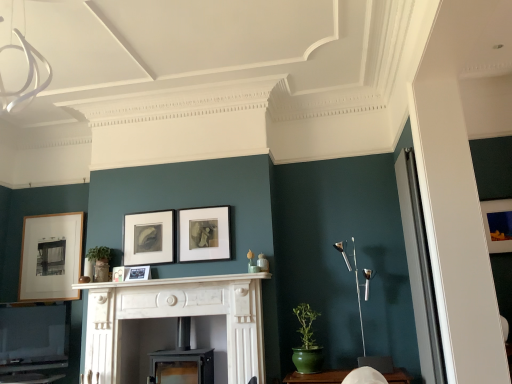
Question: From the image's perspective, is black matte picture frame at center, the fifth picture frame when ordered from left to right, beneath matte black picture frame at center, the third picture frame viewed from the left?

Choices:
 (A) yes
 (B) no

Answer: (B)

Question: From a real-world perspective, is black matte picture frame at center, the fifth picture frame when ordered from left to right, physically below matte black picture frame at center, the third picture frame viewed from the left?

Choices:
 (A) no
 (B) yes

Answer: (A)

Question: Is black matte picture frame at center, placed as the 2th picture frame when sorted from right to left, aimed at matte black picture frame at center, the fourth picture frame positioned from the right?

Choices:
 (A) no
 (B) yes

Answer: (A)

Question: Does black matte picture frame at center, the fifth picture frame when ordered from left to right, appear on the right side of matte black picture frame at center, the fourth picture frame positioned from the right?

Choices:
 (A) yes
 (B) no

Answer: (A)

Question: Does black matte picture frame at center, placed as the 2th picture frame when sorted from right to left, come behind matte black picture frame at center, the fourth picture frame positioned from the right?

Choices:
 (A) yes
 (B) no

Answer: (B)

Question: Considering the relative sizes of black matte picture frame at center, placed as the 2th picture frame when sorted from right to left, and matte black picture frame at center, the fourth picture frame positioned from the right, in the image provided, is black matte picture frame at center, placed as the 2th picture frame when sorted from right to left, wider than matte black picture frame at center, the fourth picture frame positioned from the right,?

Choices:
 (A) yes
 (B) no

Answer: (B)

Question: Can you confirm if green ceramic table at lower center is smaller than matte black picture frame at center, positioned as the fourth picture frame in left-to-right order?

Choices:
 (A) yes
 (B) no

Answer: (B)

Question: Are green ceramic table at lower center and matte black picture frame at center, positioned as the fourth picture frame in left-to-right order, located far from each other?

Choices:
 (A) no
 (B) yes

Answer: (B)

Question: Considering the relative positions of green ceramic table at lower center and matte black picture frame at center, which ranks as the 3th picture frame in right-to-left order, in the image provided, is green ceramic table at lower center to the right of matte black picture frame at center, which ranks as the 3th picture frame in right-to-left order, from the viewer's perspective?

Choices:
 (A) yes
 (B) no

Answer: (A)

Question: Can you confirm if green ceramic table at lower center is positioned to the left of matte black picture frame at center, positioned as the fourth picture frame in left-to-right order?

Choices:
 (A) no
 (B) yes

Answer: (A)

Question: Is green ceramic table at lower center wider than matte black picture frame at center, positioned as the fourth picture frame in left-to-right order?

Choices:
 (A) yes
 (B) no

Answer: (A)

Question: Does green ceramic table at lower center have a larger size compared to matte black picture frame at center, which ranks as the 3th picture frame in right-to-left order?

Choices:
 (A) no
 (B) yes

Answer: (B)

Question: Does matte black picture frame at center, the 5th picture frame viewed from the right, have a lesser height compared to wooden picture frame at left, positioned as the first picture frame in left-to-right order?

Choices:
 (A) no
 (B) yes

Answer: (B)